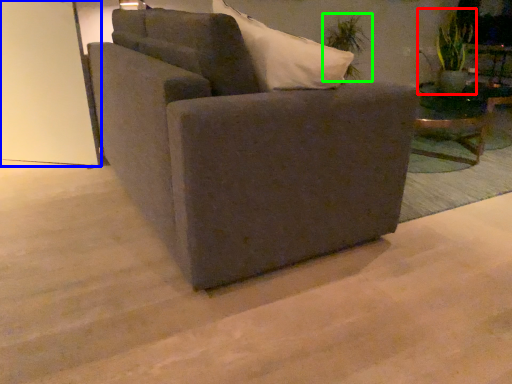
Question: Estimate the real-world distances between objects in this image. Which object is farther from plant (highlighted by a red box), glass door (highlighted by a blue box) or plant (highlighted by a green box)?

Choices:
 (A) glass door
 (B) plant

Answer: (A)